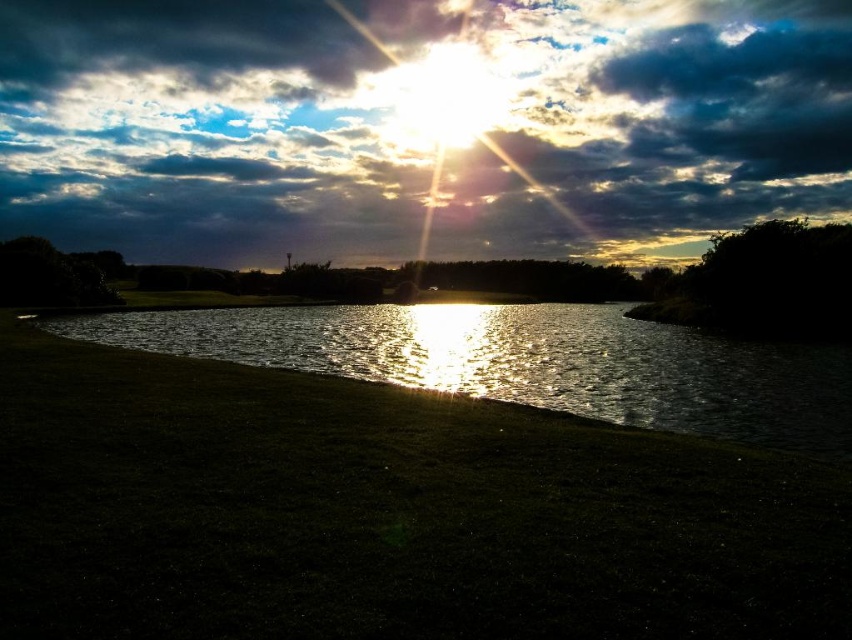
The image size is (852, 640). Describe the element at coordinates (413, 132) in the screenshot. I see `cloudy sky at upper center` at that location.

Is point (498, 33) positioned behind point (553, 312)?

That is True.

Where is `cloudy sky at upper center`? Image resolution: width=852 pixels, height=640 pixels. cloudy sky at upper center is located at coordinates (413, 132).